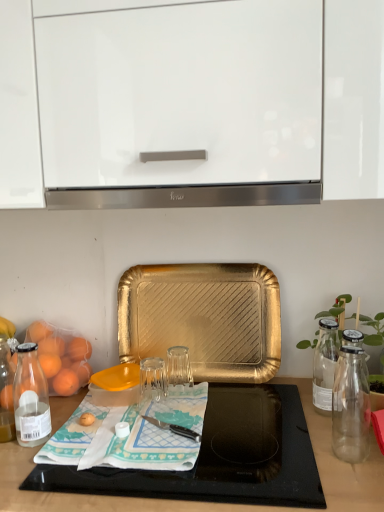
You are a GUI agent. You are given a task and a screenshot of the screen. Output one action in this format:
    pyautogui.click(x=<x>, y=<y>)
    Task: Click on the free spot to the right of transparent glass at center
    
    Given the screenshot: What is the action you would take?
    pyautogui.click(x=221, y=410)